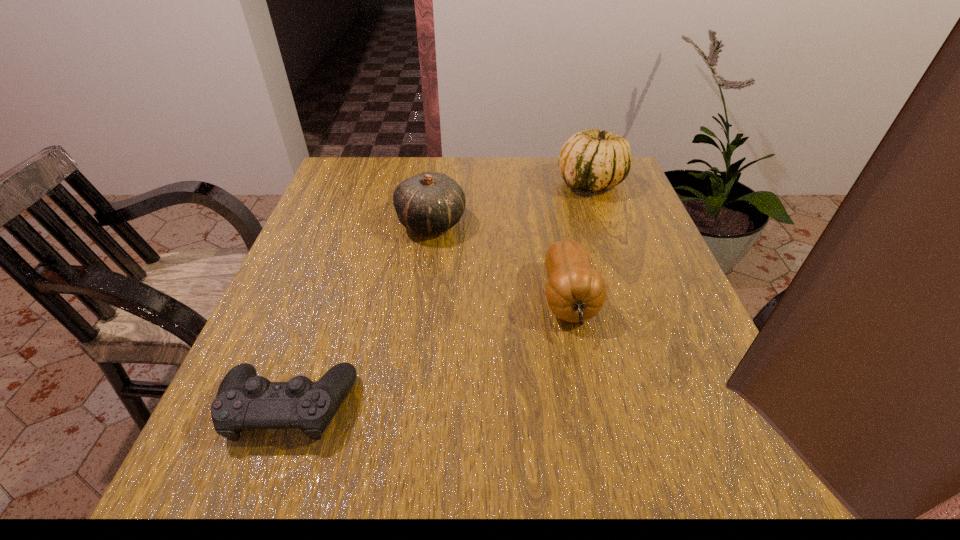
This screenshot has width=960, height=540. What are the coordinates of `unoccupied area between the leftmost object and the farthest object` in the screenshot? It's located at (440, 295).

In order to click on free area in between the second nearest object and the leftmost object in this screenshot , I will do `click(428, 353)`.

Image resolution: width=960 pixels, height=540 pixels. Identify the location of vacant region between the control and the second object from left to right. (360, 315).

The width and height of the screenshot is (960, 540). I want to click on free space between the control and the third farthest object, so click(428, 353).

Locate an element on the screen. vacant space that is in between the second nearest object and the farthest gourd is located at coordinates (580, 241).

The width and height of the screenshot is (960, 540). Find the location of `vacant space in between the farthest object and the third farthest object`. vacant space in between the farthest object and the third farthest object is located at coordinates (580, 241).

Find the location of a particular element. The width and height of the screenshot is (960, 540). vacant space that's between the farthest gourd and the leftmost object is located at coordinates (440, 295).

Identify the location of free point between the nearest gourd and the second object from left to right. (500, 261).

This screenshot has height=540, width=960. I want to click on vacant area that lies between the control and the farthest gourd, so click(x=440, y=295).

Locate an element on the screen. vacant area that lies between the farthest gourd and the second nearest object is located at coordinates (580, 241).